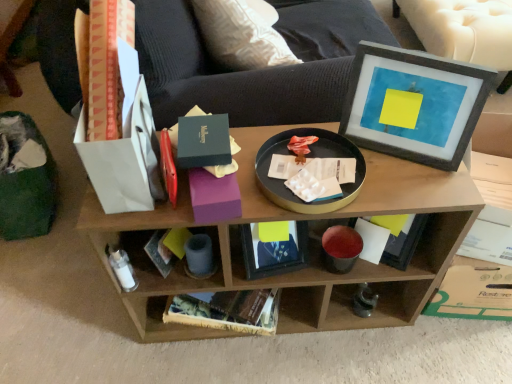
At what (x,y) coordinates should I click in order to perform the action: click on vacant space that is in between matte gray picture frame at upper right and black matte tray at center. Please return your answer as a coordinate pair (x, y). The width and height of the screenshot is (512, 384). Looking at the image, I should click on (376, 172).